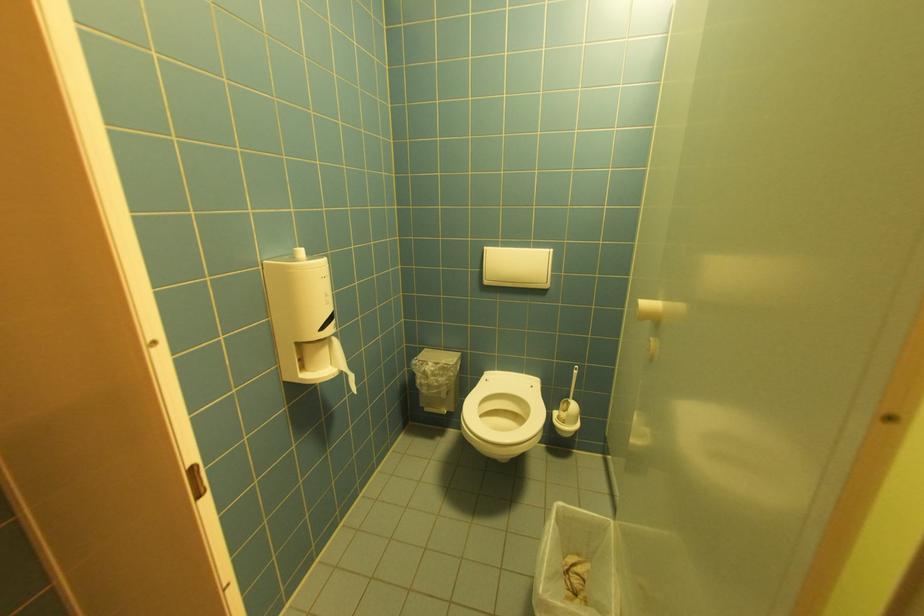
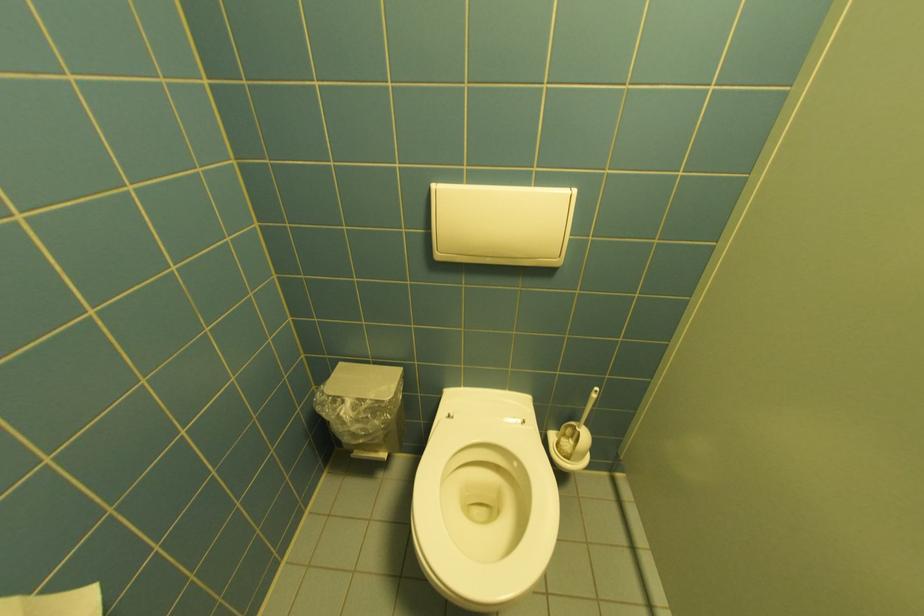
Locate, in the second image, the point that corresponds to (538,387) in the first image.

(529, 424)